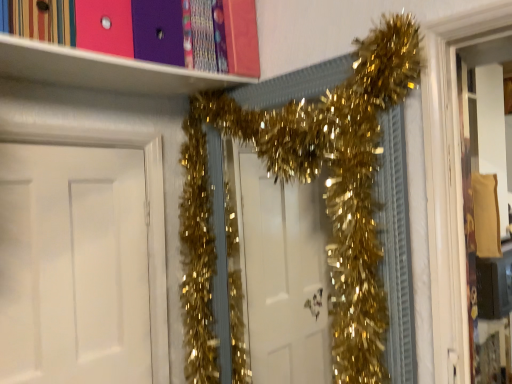
What is the approximate width of gold tinsel garland at center?

gold tinsel garland at center is 8.62 inches in width.

The width and height of the screenshot is (512, 384). I want to click on gold tinsel garland at center, so click(x=307, y=182).

Describe the element at coordinates (307, 182) in the screenshot. I see `gold tinsel garland at center` at that location.

You are a GUI agent. You are given a task and a screenshot of the screen. Output one action in this format:
    pyautogui.click(x=<x>, y=<y>)
    Task: Click on the white matte door at left
    This screenshot has height=384, width=512.
    Given the screenshot: What is the action you would take?
    pyautogui.click(x=73, y=266)

What do you see at coordinates (73, 266) in the screenshot? Image resolution: width=512 pixels, height=384 pixels. I see `white matte door at left` at bounding box center [73, 266].

You are a GUI agent. You are given a task and a screenshot of the screen. Output one action in this format:
    pyautogui.click(x=<x>, y=<y>)
    Task: Click on the gold tinsel garland at center
    
    Given the screenshot: What is the action you would take?
    pyautogui.click(x=307, y=182)

Between gold tinsel garland at center and white matte door at left, which one appears on the left side from the viewer's perspective?

white matte door at left is more to the left.

Consider the image. Which object is closer to the camera, gold tinsel garland at center or white matte door at left?

Positioned in front is gold tinsel garland at center.

Which is less distant, (x=349, y=183) or (x=146, y=303)?

Point (x=349, y=183) is positioned closer to the camera compared to point (x=146, y=303).

From the image's perspective, which one is positioned lower, gold tinsel garland at center or white matte door at left?

white matte door at left, from the image's perspective.

From the picture: From a real-world perspective, who is located lower, gold tinsel garland at center or white matte door at left?

white matte door at left is physically lower.

Which of these two, gold tinsel garland at center or white matte door at left, is thinner?

white matte door at left.

Considering the relative sizes of gold tinsel garland at center and white matte door at left in the image provided, is gold tinsel garland at center taller than white matte door at left?

Indeed, gold tinsel garland at center has a greater height compared to white matte door at left.

From the picture: Can you confirm if gold tinsel garland at center is bigger than white matte door at left?

Indeed, gold tinsel garland at center has a larger size compared to white matte door at left.

Can white matte door at left be found inside gold tinsel garland at center?

Definitely not — white matte door at left is not inside gold tinsel garland at center.

From the picture: Is the surface of gold tinsel garland at center in direct contact with white matte door at left?

No, gold tinsel garland at center is not next to white matte door at left.

Could you tell me if gold tinsel garland at center is facing white matte door at left?

Yes.

What's the angular difference between gold tinsel garland at center and white matte door at left's facing directions?

The facing directions of gold tinsel garland at center and white matte door at left are 89.6 degrees apart.

The image size is (512, 384). I want to click on christmas decoration on the right of white matte door at left, so click(x=307, y=182).

Can you confirm if white matte door at left is positioned to the left of gold tinsel garland at center?

Yes, white matte door at left is to the left of gold tinsel garland at center.

Which object is more forward, white matte door at left or gold tinsel garland at center?

Positioned in front is gold tinsel garland at center.

Which is behind, point (34, 179) or point (361, 161)?

The point (34, 179) is farther.

From the image's perspective, is white matte door at left under gold tinsel garland at center?

Correct, white matte door at left appears lower than gold tinsel garland at center in the image.

From a real-world perspective, is white matte door at left over gold tinsel garland at center?

Actually, white matte door at left is physically below gold tinsel garland at center in the real world.

Which of these two, white matte door at left or gold tinsel garland at center, is thinner?

white matte door at left is thinner.

Who is taller, white matte door at left or gold tinsel garland at center?

gold tinsel garland at center is taller.

Who is bigger, white matte door at left or gold tinsel garland at center?

gold tinsel garland at center is bigger.

Would you say white matte door at left is inside or outside gold tinsel garland at center?

white matte door at left exists outside the volume of gold tinsel garland at center.

Are white matte door at left and gold tinsel garland at center located far from each other?

No, white matte door at left is not far from gold tinsel garland at center.

Is gold tinsel garland at center at the back of white matte door at left?

No, white matte door at left is not facing the opposite direction of gold tinsel garland at center.

How different are the orientations of white matte door at left and gold tinsel garland at center in degrees?

89.6 degrees.

The height and width of the screenshot is (384, 512). In order to click on christmas decoration in front of the white matte door at left in this screenshot , I will do `click(307, 182)`.

Where is `door behind the gold tinsel garland at center`? The width and height of the screenshot is (512, 384). door behind the gold tinsel garland at center is located at coordinates (73, 266).

The width and height of the screenshot is (512, 384). In order to click on christmas decoration to the right of white matte door at left in this screenshot , I will do (307, 182).